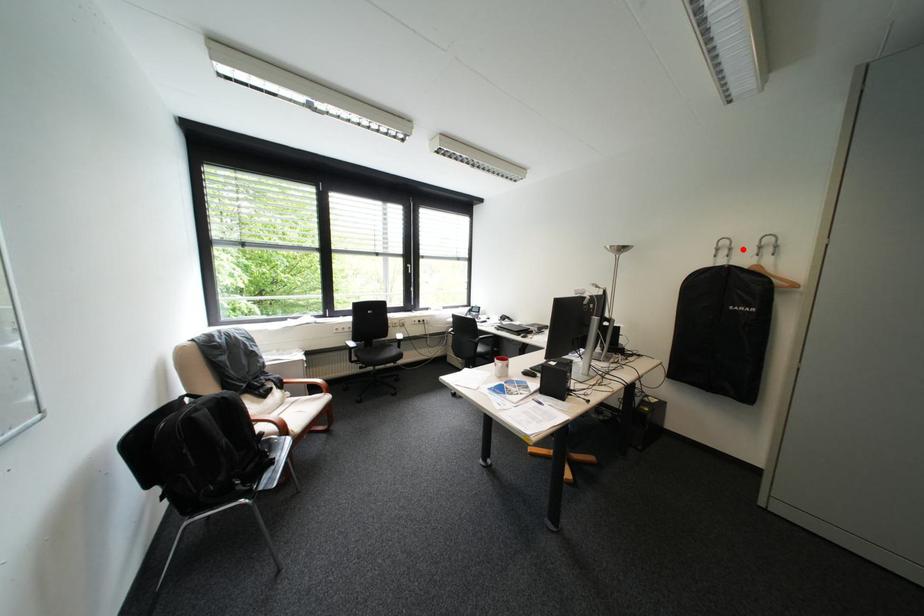
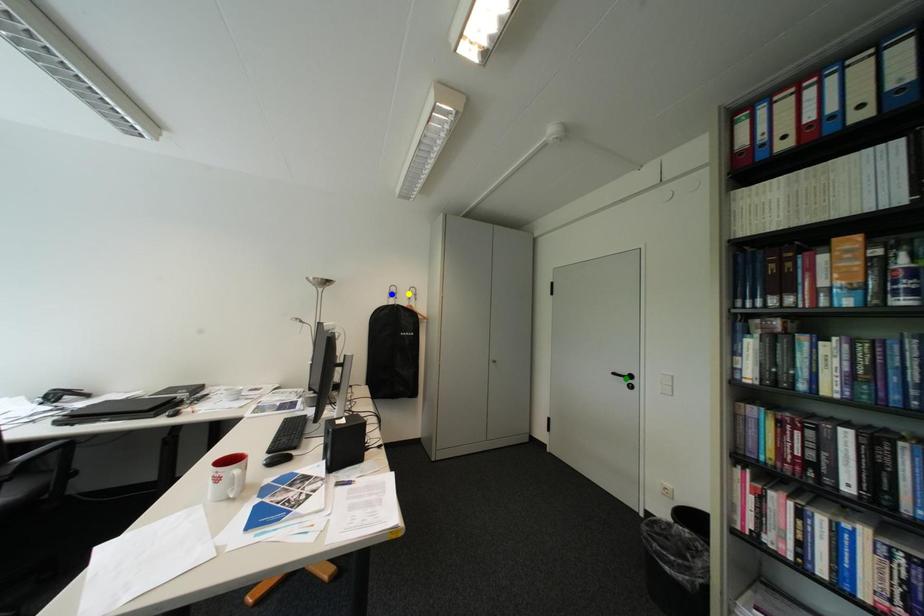
Question: I am providing you with two images of the same scene from different viewpoints. A red point is marked on the first image. You are given multiple points on the second image. Which spot in image 2 lines up with the point in image 1?

Choices:
 (A) yellow point
 (B) blue point
 (C) green point

Answer: (A)